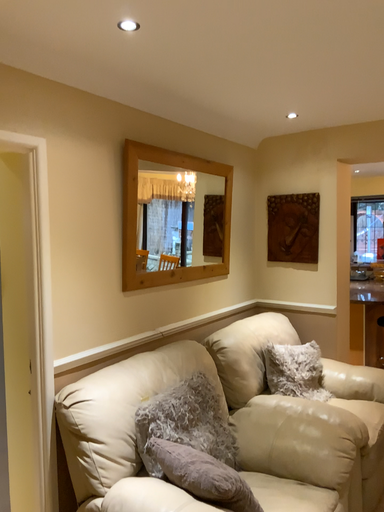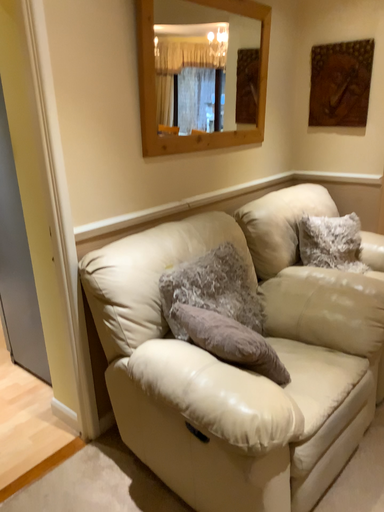
Question: How did the camera likely rotate when shooting the video?

Choices:
 (A) rotated downward
 (B) rotated upward

Answer: (A)